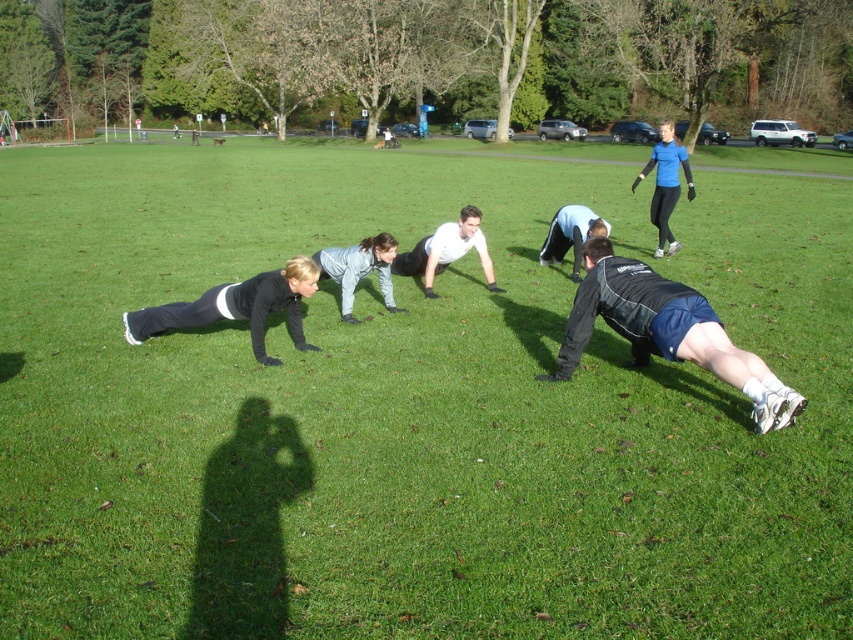
You are standing at the origin point of the coordinate system. You see two points, point (204, 314) and point (363, 266). Which point is closer to you?

Point (204, 314) is in front of point (363, 266), so it is closer to you.

You are standing at the point with coordinates point (x=453, y=237) and want to walk towards the point with coordinates point (x=292, y=323). Which direction should you face to move towards it?

You should face the direction towards the point (x=292, y=323) because it is in front of point (x=453, y=237).